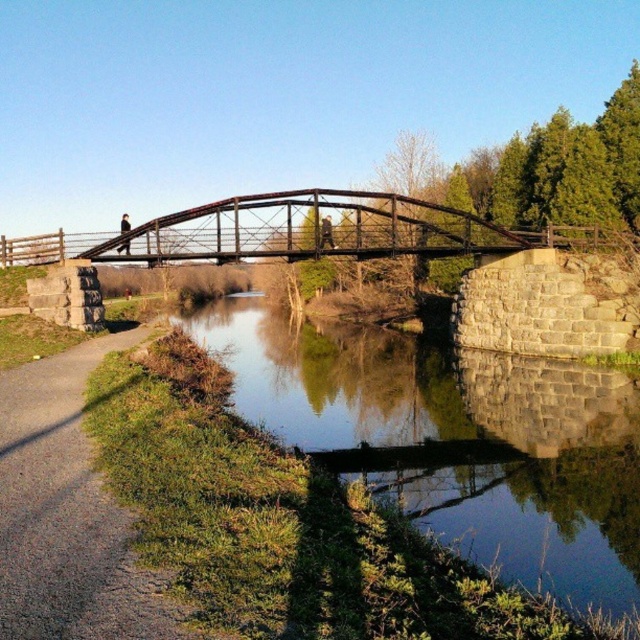
In the scene shown: Who is positioned more to the left, smooth concrete water at center or gravel path at lower left?

gravel path at lower left is more to the left.

Does smooth concrete water at center have a larger size compared to gravel path at lower left?

Indeed, smooth concrete water at center has a larger size compared to gravel path at lower left.

Identify the location of smooth concrete water at center. (454, 440).

At what (x,y) coordinates should I click in order to perform the action: click on smooth concrete water at center. Please return your answer as a coordinate pair (x, y). The width and height of the screenshot is (640, 640). Looking at the image, I should click on (454, 440).